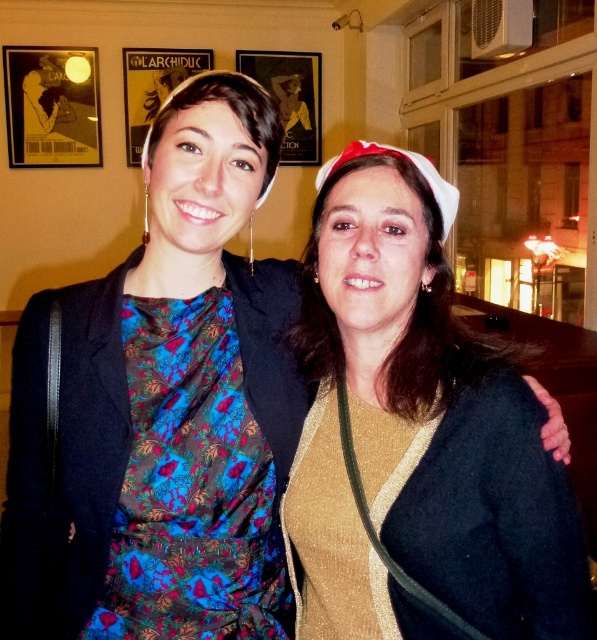
You are a photographer adjusting your camera settings. You want to ensure the gold glittery sweater at center is in focus. Since the camera has a depth of field of 30 inches, will the sweater be in focus?

The gold glittery sweater at center is 32.03 inches from the camera, which is slightly beyond the depth of field of 30 inches. Therefore, the sweater may not be in focus.

You are a photographer trying to adjust the composition of the image. You want to ensure that the gold glittery sweater at center and the floral print fabric dress at left are both visible in the frame. Given their widths, which object should you focus on to avoid cropping either of them?

The gold glittery sweater at center is wider than the floral print fabric dress at left. To avoid cropping either, focus on centering the gold glittery sweater at center since it requires more space.

You are a photographer setting up a shoot. You have two outfits to feature in the image. The gold glittery sweater at center and the floral print fabric dress at left. Based on their sizes, which outfit would you recommend placing in the foreground to ensure it stands out more?

The gold glittery sweater at center is taller than the floral print fabric dress at left, so placing the gold glittery sweater at center in the foreground would make it stand out more due to its larger size.